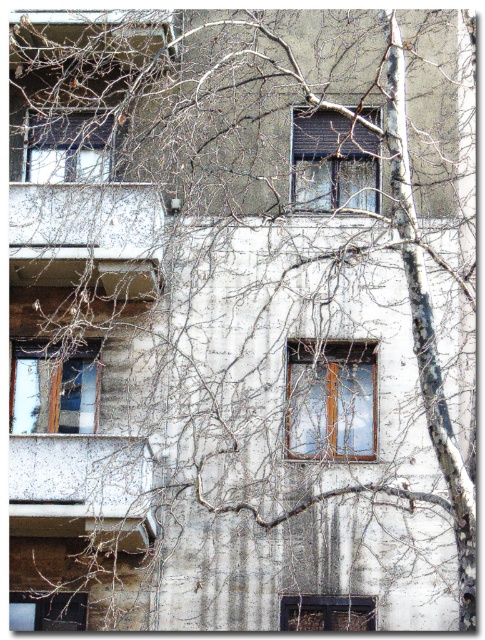
Question: Does clear glass window at center appear on the right side of wooden frame window at upper center?

Choices:
 (A) no
 (B) yes

Answer: (B)

Question: Which point is farther to the camera?

Choices:
 (A) (306, 348)
 (B) (20, 394)
 (C) (321, 163)

Answer: (C)

Question: Which object is farther from the camera taking this photo?

Choices:
 (A) clear glass window at center
 (B) wooden window at left

Answer: (B)

Question: Is clear glass window at center smaller than wooden frame window at upper center?

Choices:
 (A) yes
 (B) no

Answer: (A)

Question: Is wooden window at lower center above transparent glass window at lower left?

Choices:
 (A) yes
 (B) no

Answer: (A)

Question: Based on their relative distances, which object is farther from the matte black window at center?

Choices:
 (A) wooden frame window at upper center
 (B) wooden window at lower center

Answer: (B)